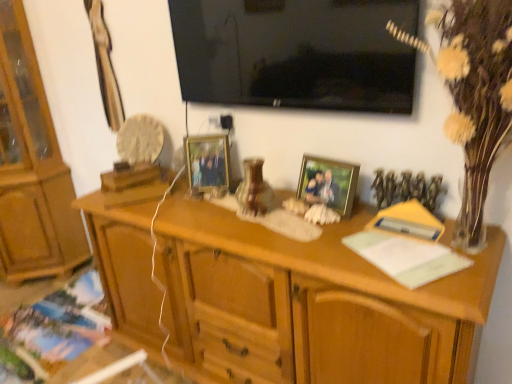
Question: From a real-world perspective, is matte wooden picture frame at center, which is counted as the second picture frame, starting from the front, on top of metallic gold picture frame at center, which is counted as the 1th picture frame, starting from the right?

Choices:
 (A) yes
 (B) no

Answer: (A)

Question: Is matte wooden picture frame at center, marked as the first picture frame in a back-to-front arrangement, further to the viewer compared to metallic gold picture frame at center, which is counted as the 1th picture frame, starting from the right?

Choices:
 (A) no
 (B) yes

Answer: (B)

Question: Are matte wooden picture frame at center, arranged as the second picture frame when viewed from the right, and metallic gold picture frame at center, which is counted as the 1th picture frame, starting from the right, making contact?

Choices:
 (A) yes
 (B) no

Answer: (B)

Question: Is matte wooden picture frame at center, which appears as the first picture frame when viewed from the left, facing away from metallic gold picture frame at center, which is counted as the 1th picture frame, starting from the right?

Choices:
 (A) yes
 (B) no

Answer: (B)

Question: Does matte wooden picture frame at center, marked as the first picture frame in a back-to-front arrangement, have a lesser width compared to metallic gold picture frame at center, which is the 1th picture frame from front to back?

Choices:
 (A) no
 (B) yes

Answer: (A)

Question: Is matte wooden picture frame at center, marked as the first picture frame in a back-to-front arrangement, aimed at metallic gold picture frame at center, the second picture frame positioned from the left?

Choices:
 (A) no
 (B) yes

Answer: (A)

Question: Can you confirm if light brown wood cabinet at left is shorter than metallic gold picture frame at center, the second picture frame positioned from the left?

Choices:
 (A) yes
 (B) no

Answer: (B)

Question: Is light brown wood cabinet at left to the left of metallic gold picture frame at center, which is counted as the 1th picture frame, starting from the right, from the viewer's perspective?

Choices:
 (A) no
 (B) yes

Answer: (B)

Question: Can you confirm if light brown wood cabinet at left is taller than metallic gold picture frame at center, the second picture frame positioned from the left?

Choices:
 (A) no
 (B) yes

Answer: (B)

Question: From the image's perspective, would you say light brown wood cabinet at left is shown under metallic gold picture frame at center, the second picture frame positioned from the left?

Choices:
 (A) no
 (B) yes

Answer: (A)

Question: Would you consider light brown wood cabinet at left to be distant from metallic gold picture frame at center, acting as the 2th picture frame starting from the back?

Choices:
 (A) no
 (B) yes

Answer: (B)

Question: Is light brown wood cabinet at left beside metallic gold picture frame at center, the second picture frame positioned from the left?

Choices:
 (A) yes
 (B) no

Answer: (B)

Question: Can we say yellow paper at right, which appears as the first book when viewed from the top, lies outside white textured vase at right?

Choices:
 (A) no
 (B) yes

Answer: (A)